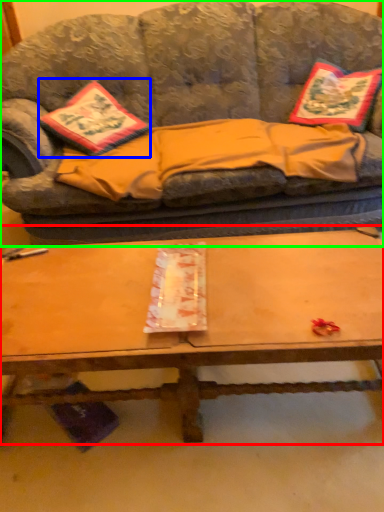
Question: Which object is the closest to the coffee table (highlighted by a red box)? Choose among these: throw pillow (highlighted by a blue box) or studio couch (highlighted by a green box).

Choices:
 (A) throw pillow
 (B) studio couch

Answer: (B)